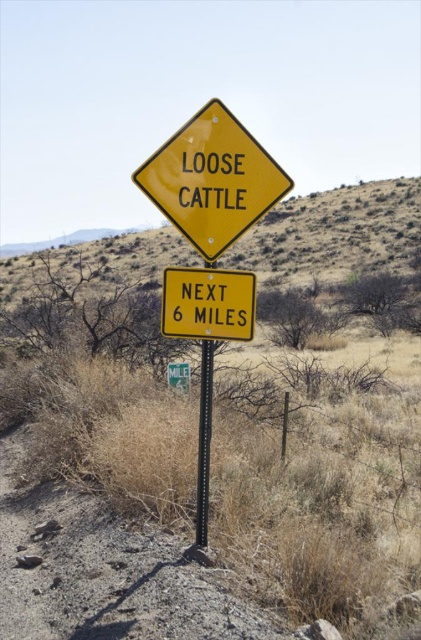
Question: Can you confirm if yellow matte diamond at center is positioned to the left of black metal pole at center?

Choices:
 (A) yes
 (B) no

Answer: (B)

Question: Considering the relative positions of yellow matte sign at center and black metal pole at center in the image provided, where is yellow matte sign at center located with respect to black metal pole at center?

Choices:
 (A) right
 (B) left

Answer: (A)

Question: Which object appears closest to the camera in this image?

Choices:
 (A) black metal pole at center
 (B) yellow matte sign at center
 (C) yellow plastic sign at center

Answer: (C)

Question: Among these objects, which one is farthest from the camera?

Choices:
 (A) yellow plastic sign at center
 (B) yellow matte diamond at center

Answer: (B)

Question: Does yellow matte diamond at center come behind black metal pole at center?

Choices:
 (A) yes
 (B) no

Answer: (B)

Question: Which of the following is the closest to the observer?

Choices:
 (A) black metal pole at center
 (B) yellow matte diamond at center

Answer: (B)